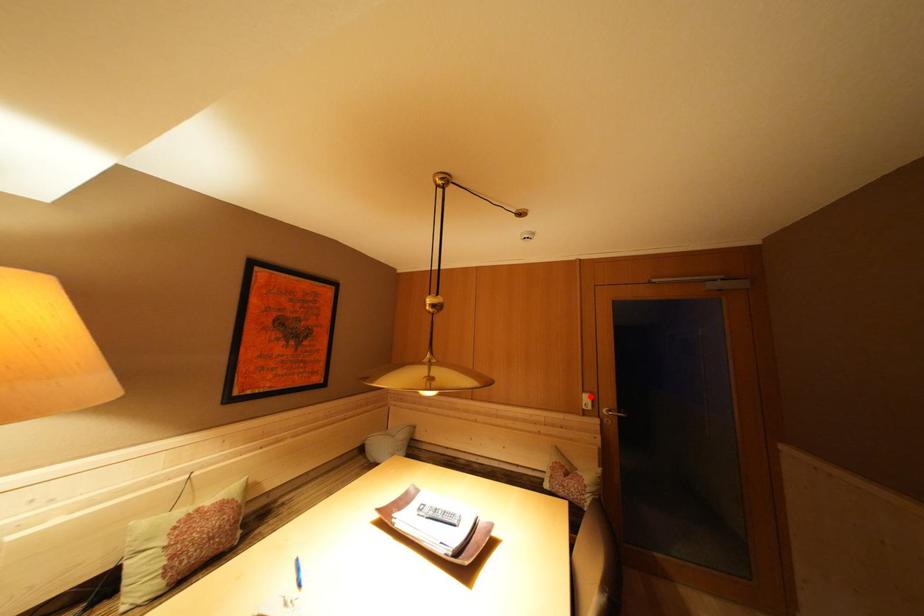
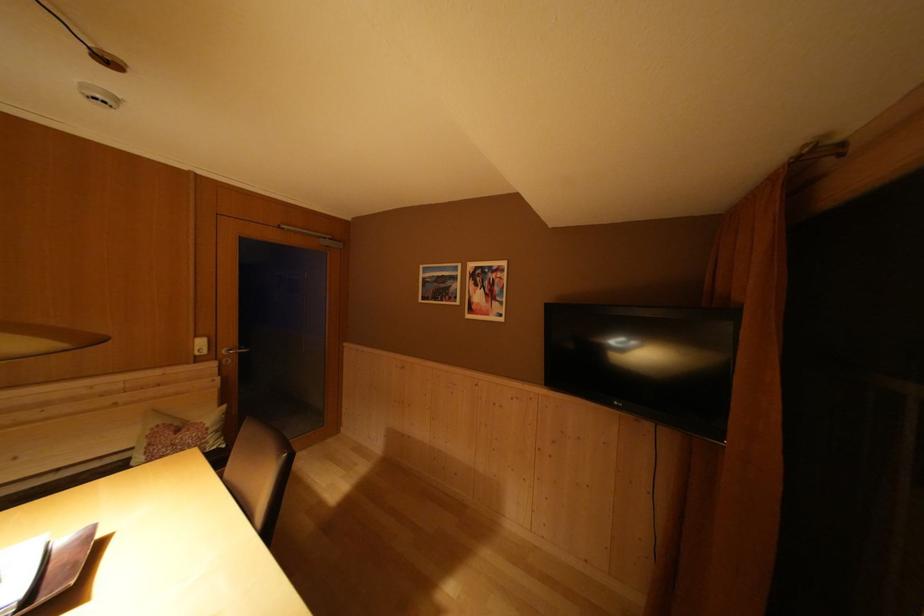
In the second image, find the point that corresponds to the highlighted location in the first image.

(203, 342)